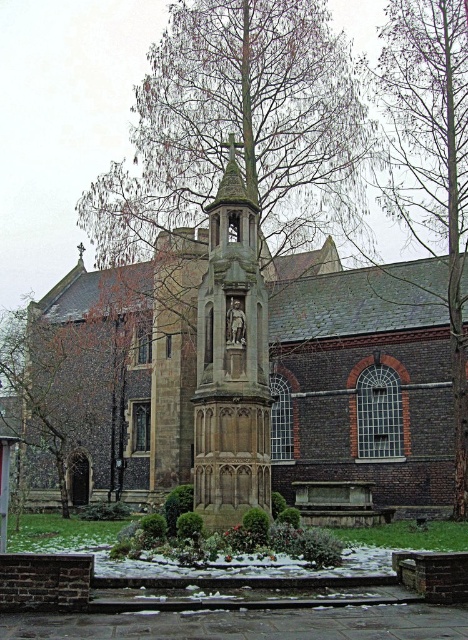
Question: Does bare wood tree at right appear on the left side of stone statue at center?

Choices:
 (A) no
 (B) yes

Answer: (A)

Question: Is brown stone church at center below stone statue at center?

Choices:
 (A) yes
 (B) no

Answer: (A)

Question: Among these points, which one is farthest from the camera?

Choices:
 (A) (311, 326)
 (B) (249, 301)
 (C) (460, 195)

Answer: (A)

Question: Which point is closer to the camera?

Choices:
 (A) brown stone church at center
 (B) bare wood tree at right

Answer: (A)

Question: Is bare wood tree at right bigger than stone statue at center?

Choices:
 (A) no
 (B) yes

Answer: (B)

Question: Which object is closer to the camera taking this photo?

Choices:
 (A) brown stone church at center
 (B) bare wood tree at right

Answer: (A)